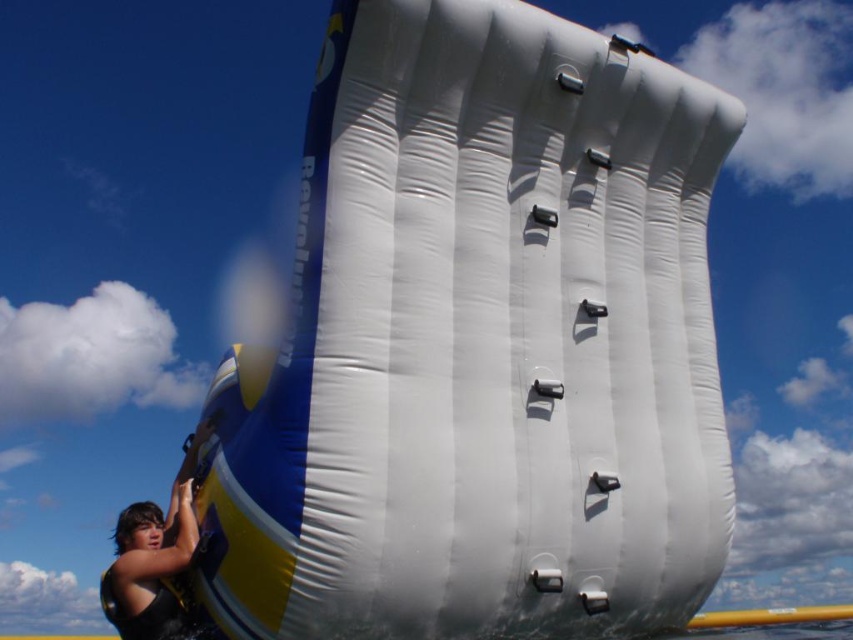
Question: Considering the relative positions of white inflatable wall at center and black fabric at left in the image provided, where is white inflatable wall at center located with respect to black fabric at left?

Choices:
 (A) right
 (B) left

Answer: (A)

Question: Which point is closer to the camera?

Choices:
 (A) (430, 28)
 (B) (187, 632)

Answer: (A)

Question: Does white inflatable wall at center appear over black fabric at left?

Choices:
 (A) no
 (B) yes

Answer: (B)

Question: Can you confirm if white inflatable wall at center is wider than black fabric at left?

Choices:
 (A) yes
 (B) no

Answer: (A)

Question: Which point is farther to the camera?

Choices:
 (A) (155, 602)
 (B) (654, 266)

Answer: (B)